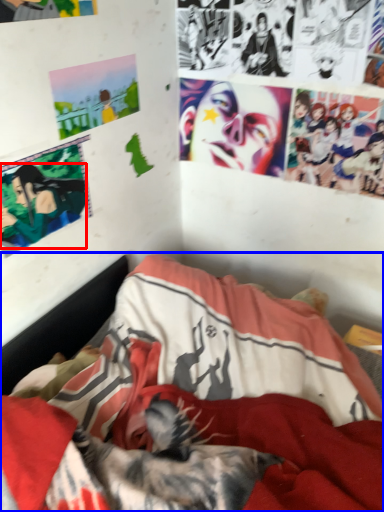
Question: Which object is further to the camera taking this photo, person (highlighted by a red box) or bed (highlighted by a blue box)?

Choices:
 (A) person
 (B) bed

Answer: (A)